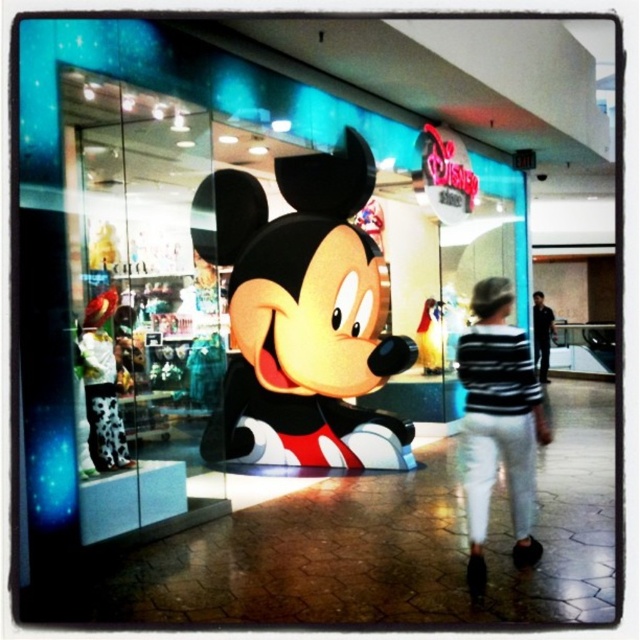
What do you see at coordinates (301, 316) in the screenshot? I see `matte plastic mickey mouse at center` at bounding box center [301, 316].

Does matte plastic mickey mouse at center appear over striped sweater at center?

Indeed, matte plastic mickey mouse at center is positioned over striped sweater at center.

Between point (268, 285) and point (532, 413), which one is positioned in front?

Point (532, 413) is in front.

Find the location of `matte plastic mickey mouse at center`. matte plastic mickey mouse at center is located at coordinates (301, 316).

Which is behind, point (515, 461) or point (100, 365)?

The point (100, 365) is behind.

Is point (532, 458) positioned in front of point (109, 413)?

Yes, point (532, 458) is in front of point (109, 413).

Locate an element on the screen. This screenshot has height=640, width=640. striped sweater at center is located at coordinates (499, 422).

Can you confirm if matte plastic mickey mouse at center is taller than black fabric shirt at right?

Yes, matte plastic mickey mouse at center is taller than black fabric shirt at right.

Does matte plastic mickey mouse at center come behind black fabric shirt at right?

That is False.

Which is in front, point (198, 248) or point (545, 339)?

Point (198, 248)

Locate an element on the screen. matte plastic mickey mouse at center is located at coordinates (301, 316).